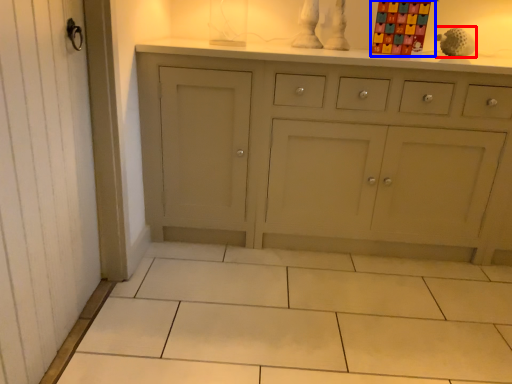
Question: Which of the following is the farthest to the observer, toy (highlighted by a red box) or toy (highlighted by a blue box)?

Choices:
 (A) toy
 (B) toy

Answer: (A)